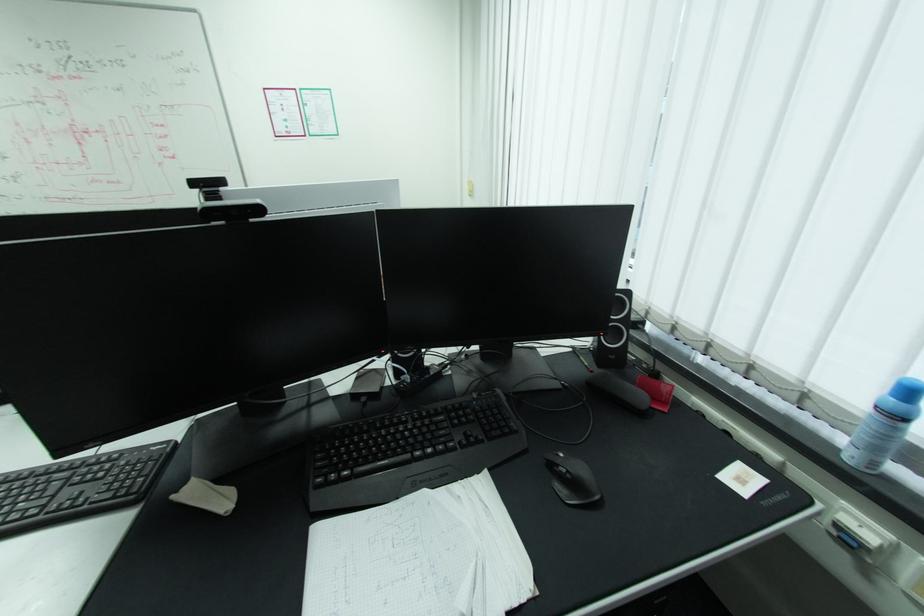
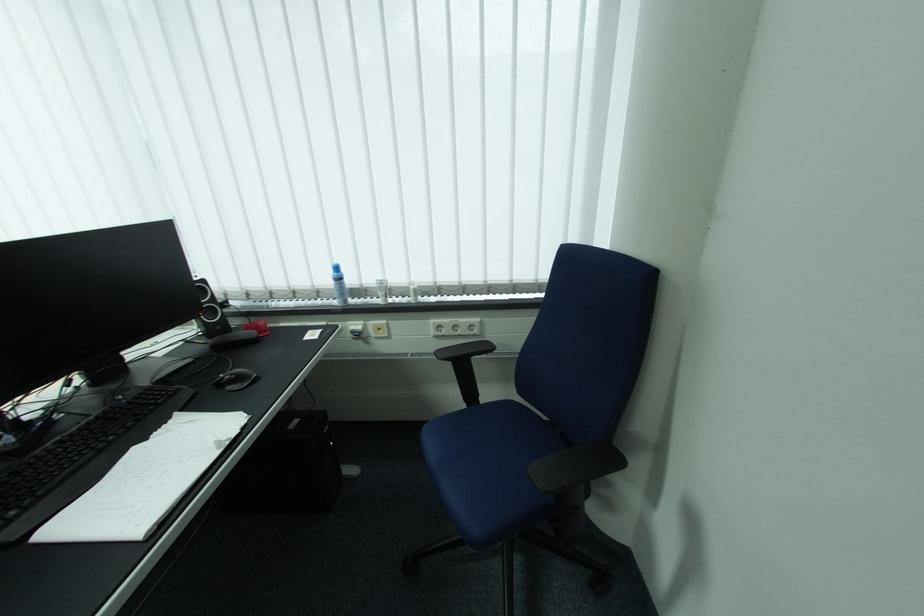
Locate, in the second image, the point that corresponds to pixel 619 357 in the first image.

(225, 328)